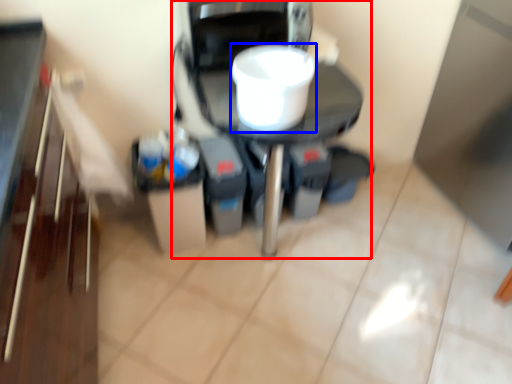
Question: Which object is further to the camera taking this photo, appliance (highlighted by a red box) or appliance (highlighted by a blue box)?

Choices:
 (A) appliance
 (B) appliance

Answer: (A)